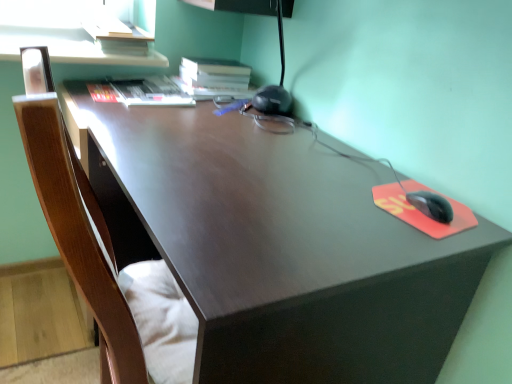
Question: Would you say hardcover book at upper center, marked as the 1th book in a right-to-left arrangement, is inside or outside matte brown desk at center?

Choices:
 (A) inside
 (B) outside

Answer: (B)

Question: Is point (196, 72) positioned closer to the camera than point (250, 336)?

Choices:
 (A) farther
 (B) closer

Answer: (A)

Question: Based on their relative distances, which object is nearer to the hardcover book at upper center, marked as the 1th book in a right-to-left arrangement?

Choices:
 (A) hardcover book at upper left, the first book viewed from the left
 (B) matte brown desk at center

Answer: (A)

Question: Based on their relative distances, which object is nearer to the hardcover book at upper left, the first book viewed from the left?

Choices:
 (A) matte brown desk at center
 (B) hardcover book at upper center, marked as the 1th book in a right-to-left arrangement

Answer: (B)